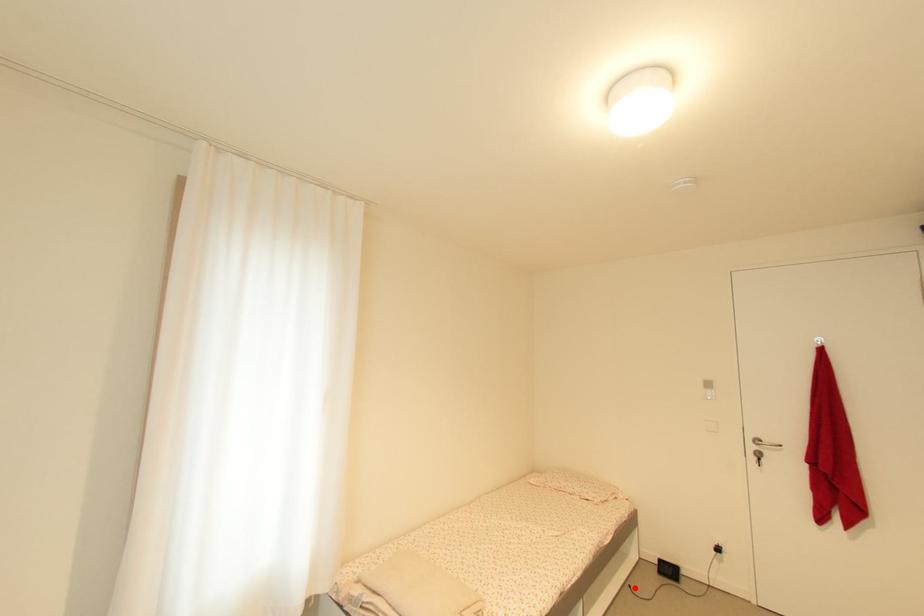
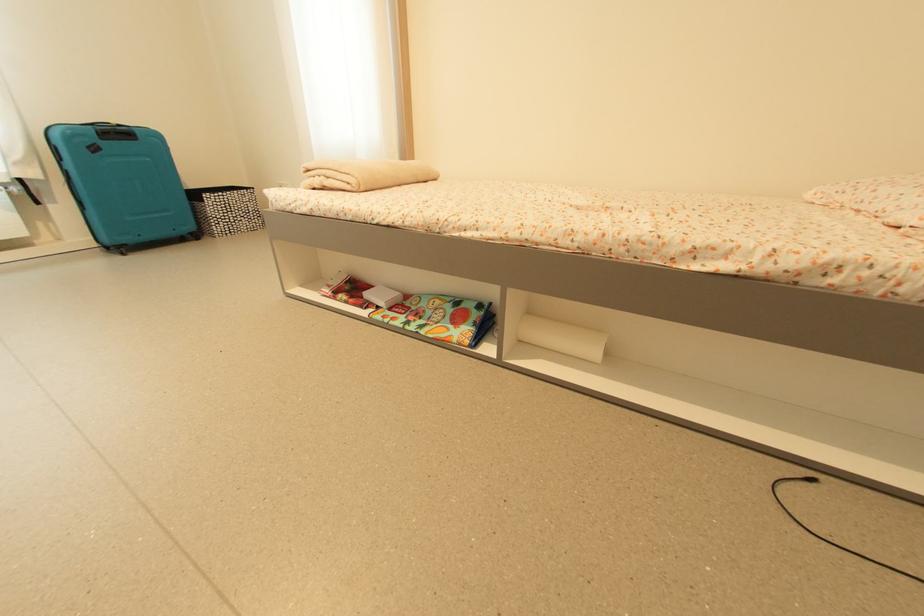
Question: I am providing you with two images of the same scene from different viewpoints. Image1 has a red point marked. In image2, the corresponding 3D location appears at what relative position? Reply with the corresponding letter.

Choices:
 (A) Closer
 (B) Farther

Answer: (B)